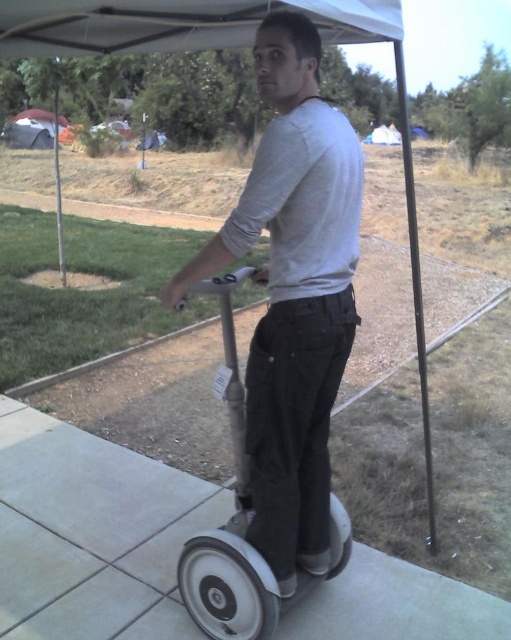
You are a photographer standing at the edge of a park. You want to take a photo of the matte gray segway at center and the metallic pole at left in the same frame. Given their sizes, which object should you position closer to the camera to make them appear similar in size in the photo?

Since the matte gray segway at center is smaller than the metallic pole at left, you should position the matte gray segway at center closer to the camera to make them appear similar in size in the photo.

You are standing at the origin point of this coordinate system where the Segway is located at point (292, 294). If you want to move towards the Segway, which direction should you move in?

The point (292, 294) corresponds to the matte gray Segway at center, so you should move towards the center to reach it.